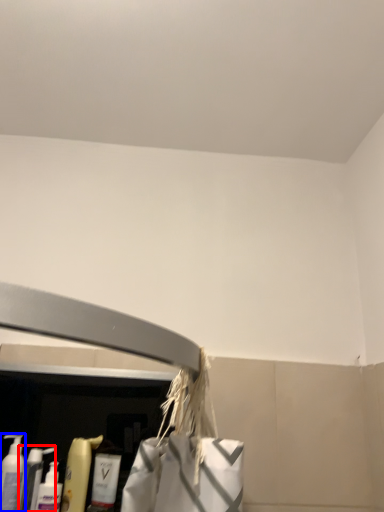
Question: Which of the following is the closest to the observer, cleaning product (highlighted by a red box) or cleaning product (highlighted by a blue box)?

Choices:
 (A) cleaning product
 (B) cleaning product

Answer: (B)